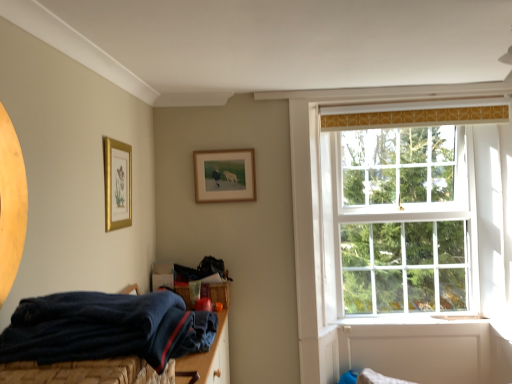
The height and width of the screenshot is (384, 512). I want to click on empty space that is ontop of white wooden window at upper right, so click(x=399, y=129).